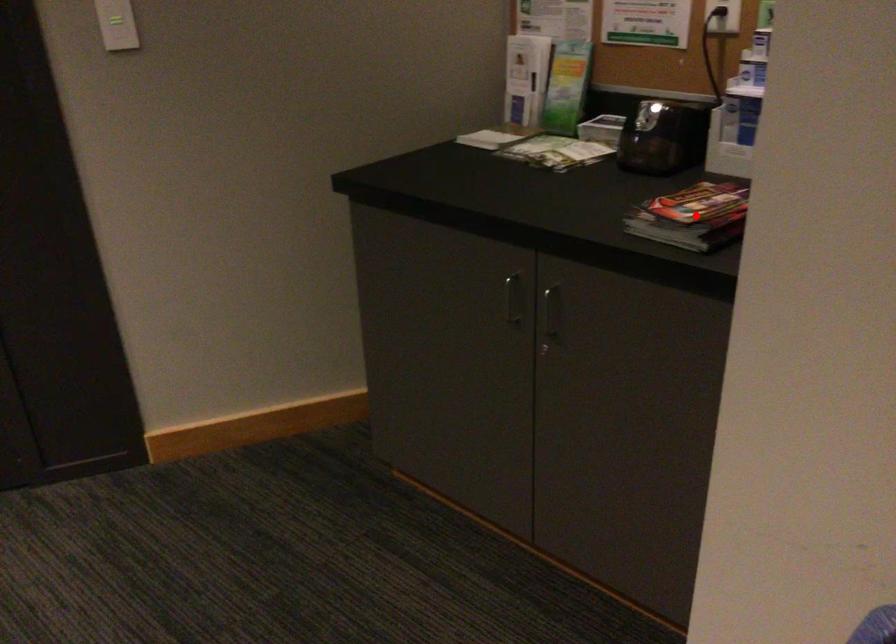
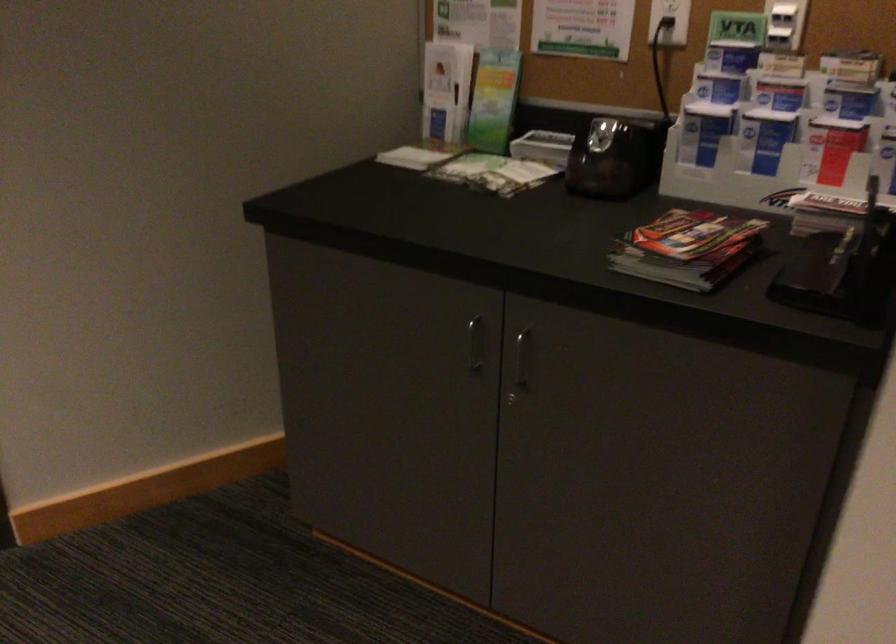
Find the pixel in the second image that matches the highlighted location in the first image.

(687, 249)